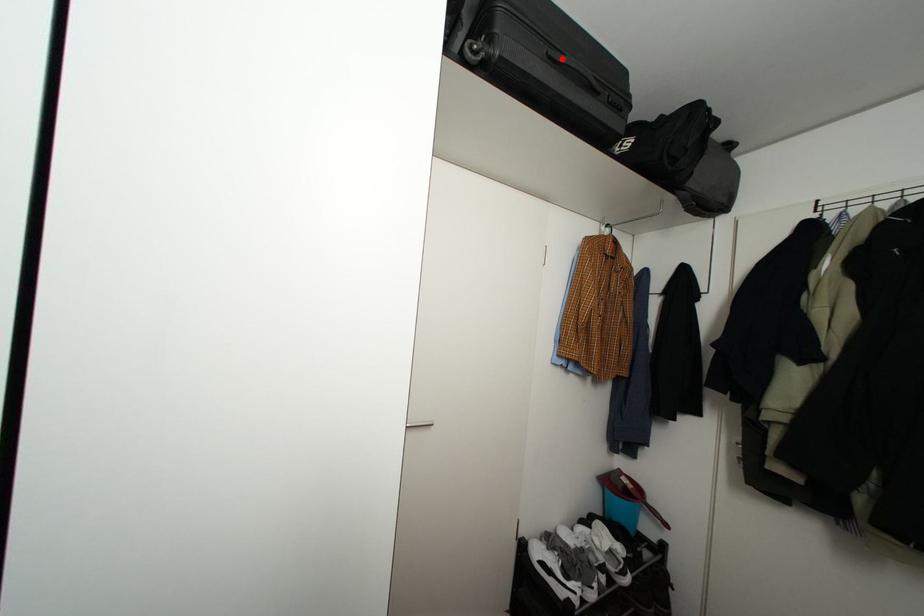
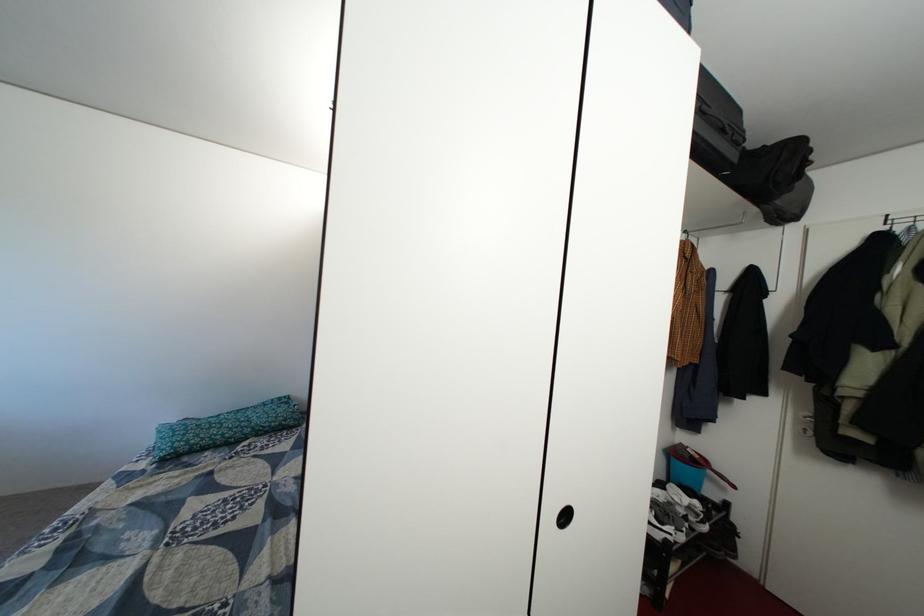
The point at the highlighted location is marked in the first image. Where is the corresponding point in the second image?

(715, 113)